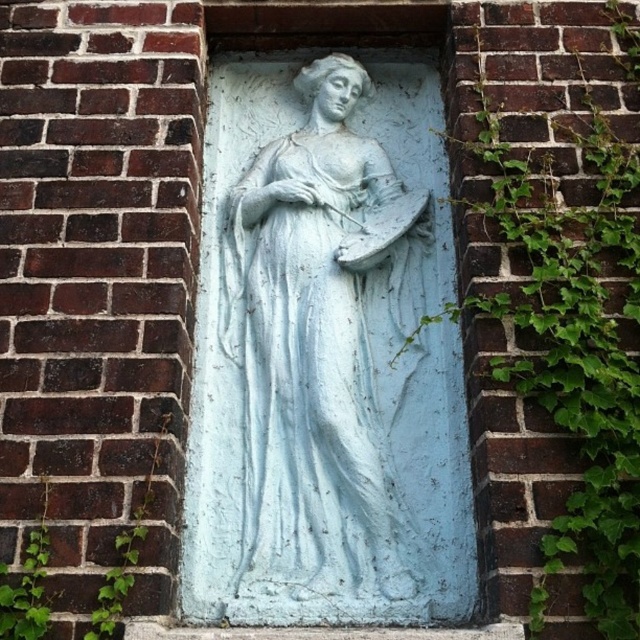
Question: Which point is farther from the camera taking this photo?

Choices:
 (A) (337, 237)
 (B) (508, 275)

Answer: (A)

Question: Where is green leafy ivy at right located in relation to white stone sculpture at center in the image?

Choices:
 (A) right
 (B) left

Answer: (A)

Question: Which of the following is the farthest from the observer?

Choices:
 (A) white stone sculpture at center
 (B) green leafy ivy at right

Answer: (A)

Question: Can you confirm if green leafy ivy at right is wider than white stone sculpture at center?

Choices:
 (A) no
 (B) yes

Answer: (A)

Question: Can you confirm if green leafy ivy at right is thinner than white stone sculpture at center?

Choices:
 (A) yes
 (B) no

Answer: (A)